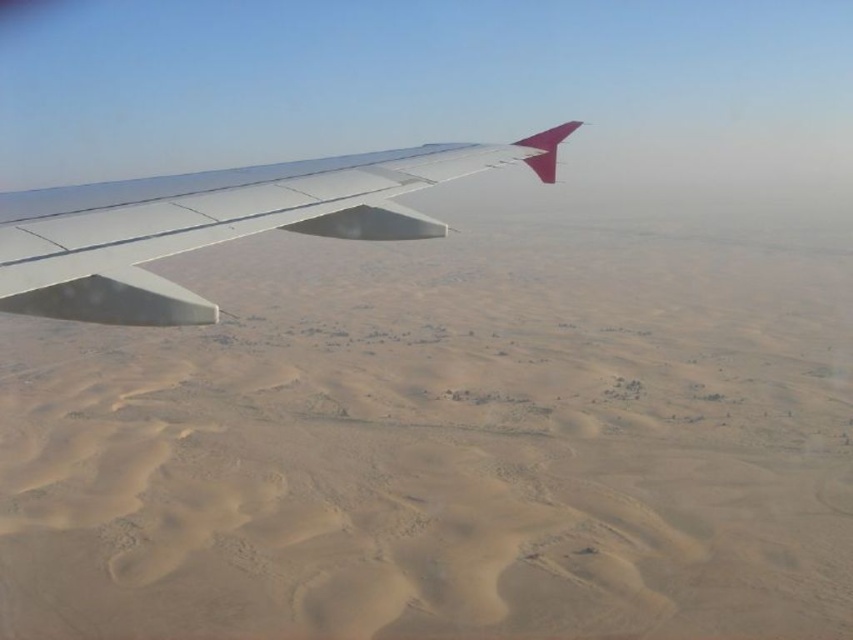
Question: Which point is closer to the camera taking this photo?

Choices:
 (A) (140, 321)
 (B) (288, 550)

Answer: (A)

Question: Is desert sand at left to the right of metallic wing at upper left from the viewer's perspective?

Choices:
 (A) yes
 (B) no

Answer: (A)

Question: Is desert sand at left thinner than metallic wing at upper left?

Choices:
 (A) no
 (B) yes

Answer: (A)

Question: Among these points, which one is nearest to the camera?

Choices:
 (A) pos(403,182)
 (B) pos(573,236)

Answer: (A)

Question: Can you confirm if desert sand at left is positioned above metallic wing at upper left?

Choices:
 (A) yes
 (B) no

Answer: (A)